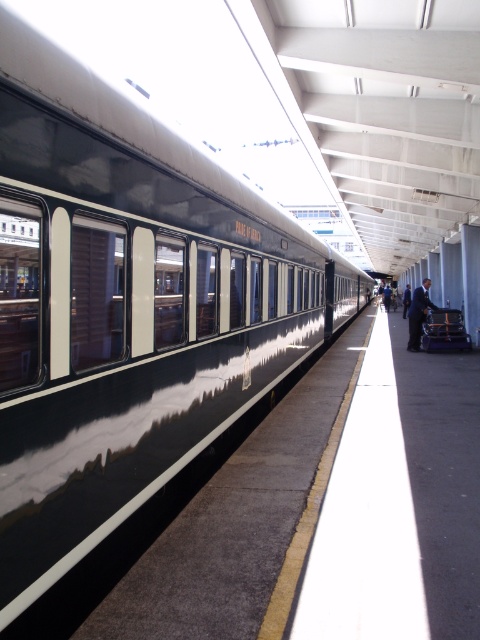
How much distance is there between dark blue suit at right and dark blue suit at platform right?

A distance of 35.59 feet exists between dark blue suit at right and dark blue suit at platform right.

Is point (419, 314) closer to camera compared to point (407, 300)?

Yes, it is.

The height and width of the screenshot is (640, 480). Find the location of `dark blue suit at right`. dark blue suit at right is located at coordinates (418, 314).

Image resolution: width=480 pixels, height=640 pixels. What do you see at coordinates (418, 314) in the screenshot?
I see `dark blue suit at right` at bounding box center [418, 314].

Who is taller, dark blue suit at right or black suit at right?

black suit at right is taller.

Locate an element on the screen. dark blue suit at right is located at coordinates (418, 314).

Can you confirm if dark blue suit at platform right is positioned to the right of black suit at right?

Incorrect, dark blue suit at platform right is not on the right side of black suit at right.

Who is shorter, dark blue suit at platform right or black suit at right?

Standing shorter between the two is dark blue suit at platform right.

Locate an element on the screen. This screenshot has width=480, height=640. dark blue suit at platform right is located at coordinates (406, 300).

Where is `dark blue suit at platform right`? dark blue suit at platform right is located at coordinates (406, 300).